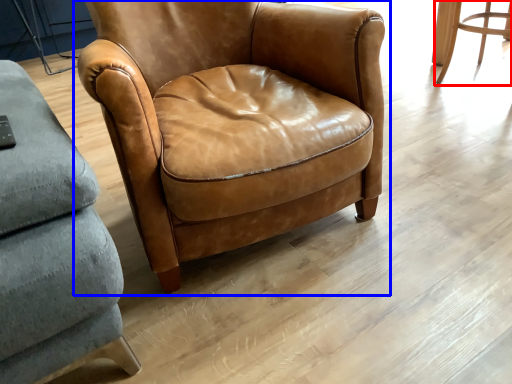
Question: Which object appears farthest to the camera in this image, chair (highlighted by a red box) or chair (highlighted by a blue box)?

Choices:
 (A) chair
 (B) chair

Answer: (A)